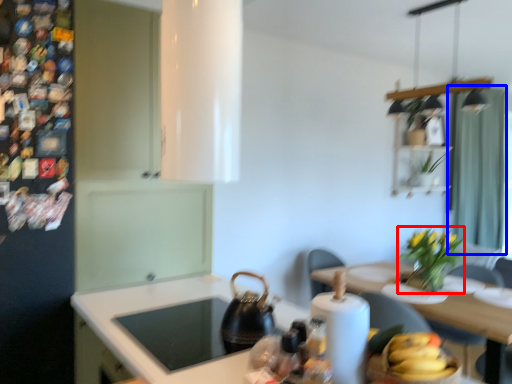
Question: Which object appears closest to the camera in this image, plant (highlighted by a red box) or curtain (highlighted by a blue box)?

Choices:
 (A) plant
 (B) curtain

Answer: (A)